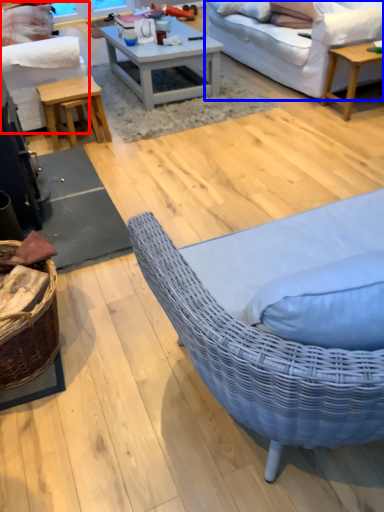
Question: Among these objects, which one is nearest to the camera, studio couch (highlighted by a red box) or studio couch (highlighted by a blue box)?

Choices:
 (A) studio couch
 (B) studio couch

Answer: (A)